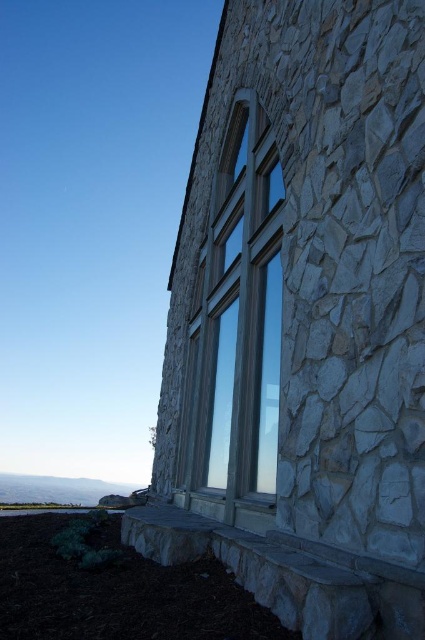
You are an architect designing a new building and want to incorporate both the gray rough stone at center and the clear glass window at center into the facade. Based on their sizes, which material should you use if you need a wider element for structural support?

The gray rough stone at center has a larger width than the clear glass window at center, so it should be used for the wider structural support element.

You are a painter standing 1.5 meters away from the gray rough stone at center. You want to paint the clear glass window at center without moving closer. Can you reach it with your brush?

The distance between the gray rough stone at center and the clear glass window at center is 2.03 meters. Since you are already 1.5 meters away from the gray rough stone at center, the clear glass window at center is an additional 2.03 meters away from you. Therefore, the total distance to the window is 1.5 meters plus 2.03 meters, totaling 3.53 meters. Most standard paintbrushes have handles around 30 cm to 1 meter in length, so reaching 3.53 meters is impossible without moving closer. You need to get 0.53m

You are standing in front of a stone wall with a window. There is a point marked at coordinates (x=303, y=317). What is the color and texture of the stone at this point?

The point at (x=303, y=317) marks a gray rough stone at center.